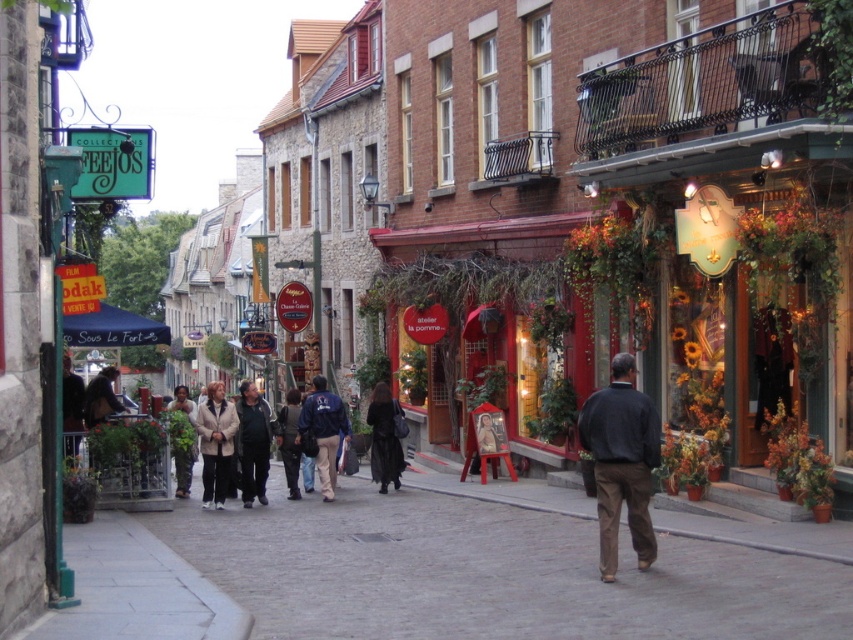
Does gray cobblestone pavement at center appear on the right side of dark gray jacket at center?

Indeed, gray cobblestone pavement at center is positioned on the right side of dark gray jacket at center.

Which is more to the left, gray cobblestone pavement at center or dark gray jacket at center?

From the viewer's perspective, dark gray jacket at center appears more on the left side.

Between point (321, 509) and point (263, 465), which one is positioned in front?

Point (321, 509) is in front.

The width and height of the screenshot is (853, 640). I want to click on gray cobblestone pavement at center, so click(492, 572).

Can you confirm if gray cobblestone pavement at center is bigger than dark gray sweater at center?

Yes.

Does gray cobblestone pavement at center have a lesser width compared to dark gray sweater at center?

No.

At what (x,y) coordinates should I click in order to perform the action: click on gray cobblestone pavement at center. Please return your answer as a coordinate pair (x, y). Looking at the image, I should click on (492, 572).

Looking at this image, who is taller, light beige coat at center or dark blue jacket at center?

dark blue jacket at center is taller.

Who is positioned more to the left, light beige coat at center or dark blue jacket at center?

Positioned to the left is light beige coat at center.

Which is in front, point (221, 465) or point (315, 404)?

Point (221, 465)

Where is `light beige coat at center`? light beige coat at center is located at coordinates (215, 444).